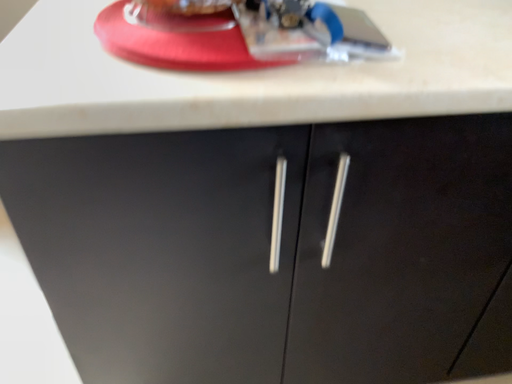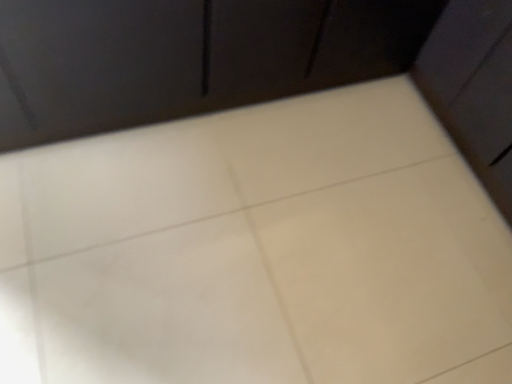
Question: Which way did the camera rotate in the video?

Choices:
 (A) rotated right
 (B) rotated left

Answer: (A)